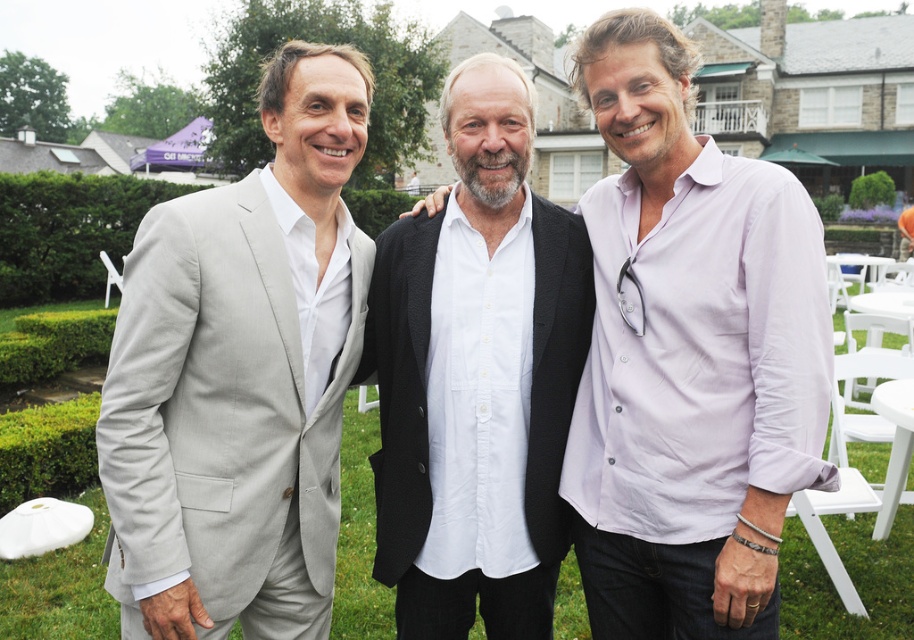
Can you confirm if matte white shirt at center is smaller than white cotton shirt at center?

Incorrect, matte white shirt at center is not smaller in size than white cotton shirt at center.

Based on the photo, who is more forward, (660, 90) or (591, 301)?

Point (660, 90)

Who is more forward, [724,572] or [431,589]?

Point [724,572] is in front.

Where is `matte white shirt at center`? matte white shirt at center is located at coordinates [689, 356].

Can you confirm if light gray suit at left is positioned below green leafy hedge at left?

Indeed, light gray suit at left is positioned under green leafy hedge at left.

Does light gray suit at left have a larger size compared to green leafy hedge at left?

Incorrect, light gray suit at left is not larger than green leafy hedge at left.

Which is behind, point (291, 241) or point (54, 294)?

The point (54, 294) is more distant.

At what (x,y) coordinates should I click in order to perform the action: click on light gray suit at left. Please return your answer as a coordinate pair (x, y). Looking at the image, I should click on (241, 376).

Locate an element on the screen. light gray suit at left is located at coordinates (241, 376).

Which is behind, point (137, 486) or point (423, 284)?

Positioned behind is point (423, 284).

Is point (211, 362) more distant than point (502, 400)?

No, (211, 362) is in front of (502, 400).

Image resolution: width=914 pixels, height=640 pixels. Identify the location of light gray suit at left. (241, 376).